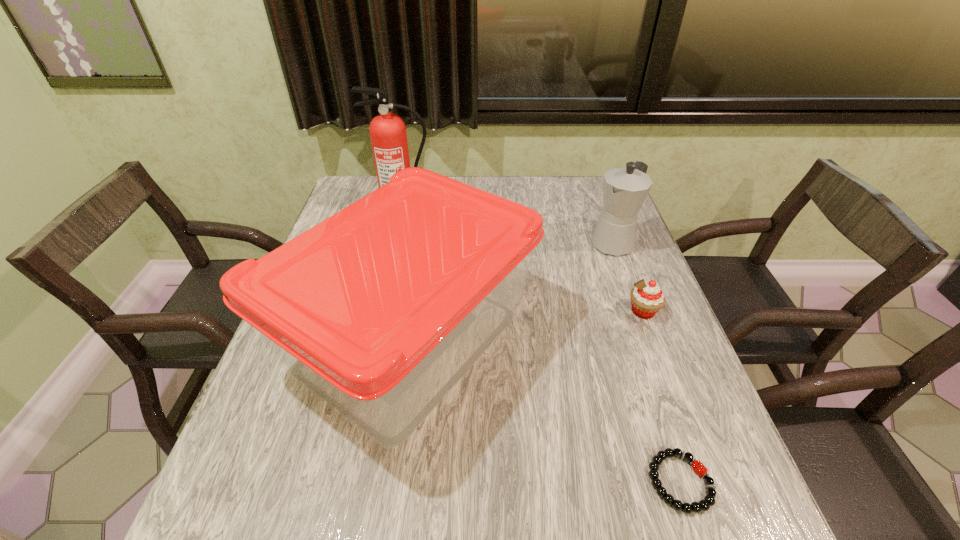
Locate an element on the screen. vacant space at the left edge of the desktop is located at coordinates (318, 404).

Find the location of a particular element. vacant space at the right edge of the desktop is located at coordinates (579, 227).

Find the location of `vacant region between the coffeepot and the shortest object`. vacant region between the coffeepot and the shortest object is located at coordinates (647, 362).

The width and height of the screenshot is (960, 540). I want to click on free space between the coffeepot and the fourth tallest object, so click(629, 276).

The width and height of the screenshot is (960, 540). Find the location of `free space that is in between the tray and the bracelet`. free space that is in between the tray and the bracelet is located at coordinates (545, 411).

Where is `unoccupied area between the tray and the second shortest object`? This screenshot has width=960, height=540. unoccupied area between the tray and the second shortest object is located at coordinates (526, 326).

Locate an element on the screen. the third closest object to the cupcake is located at coordinates (709, 500).

The width and height of the screenshot is (960, 540). In order to click on object that ranks as the third closest to the tallest object in this screenshot , I will do `click(647, 298)`.

The height and width of the screenshot is (540, 960). I want to click on vacant space that satisfies the following two spatial constraints: 1. on the handle side of the fire extinguisher; 2. on the right side of the tray, so click(x=371, y=340).

Where is `free location that satisfies the following two spatial constraints: 1. on the front side of the tray; 2. on the right side of the shortest object`? This screenshot has height=540, width=960. free location that satisfies the following two spatial constraints: 1. on the front side of the tray; 2. on the right side of the shortest object is located at coordinates (388, 482).